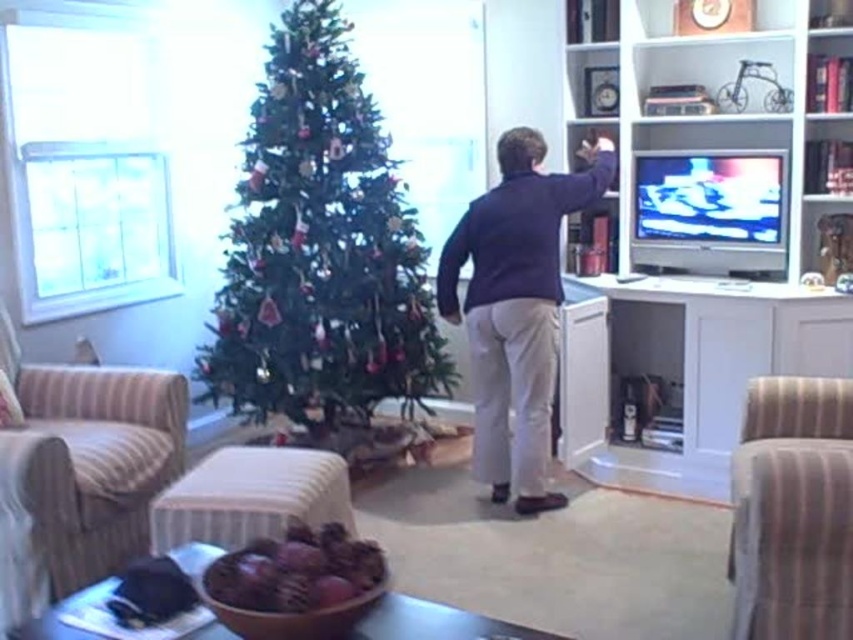
Is green matte christmas tree at center above striped fabric armchair at right?

Yes.

Does green matte christmas tree at center have a greater height compared to striped fabric armchair at right?

Correct, green matte christmas tree at center is much taller as striped fabric armchair at right.

Is point (424, 385) farther from viewer compared to point (735, 502)?

Yes, point (424, 385) is behind point (735, 502).

You are a GUI agent. You are given a task and a screenshot of the screen. Output one action in this format:
    pyautogui.click(x=<x>, y=<y>)
    Task: Click on the green matte christmas tree at center
    This screenshot has height=640, width=853.
    Given the screenshot: What is the action you would take?
    pyautogui.click(x=321, y=248)

Between point (381, 396) and point (546, 332), which one is positioned in front?

Point (546, 332) is in front.

Between green matte christmas tree at center and dark blue sweater at center, which one appears on the right side from the viewer's perspective?

Positioned to the right is dark blue sweater at center.

Measure the distance between green matte christmas tree at center and camera.

A distance of 12.86 feet exists between green matte christmas tree at center and camera.

Where is `green matte christmas tree at center`? The image size is (853, 640). green matte christmas tree at center is located at coordinates (321, 248).

Is beige striped armchair at left positioned behind striped fabric armchair at right?

Yes.

Looking at this image, does beige striped armchair at left have a greater width compared to striped fabric armchair at right?

Correct, the width of beige striped armchair at left exceeds that of striped fabric armchair at right.

Between point (138, 544) and point (793, 416), which one is positioned behind?

Positioned behind is point (138, 544).

In order to click on beige striped armchair at left in this screenshot , I will do `click(80, 472)`.